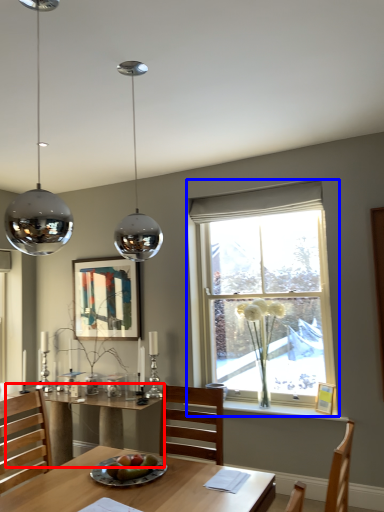
Question: Which point is further to the camera, table (highlighted by a red box) or window (highlighted by a blue box)?

Choices:
 (A) table
 (B) window

Answer: (B)